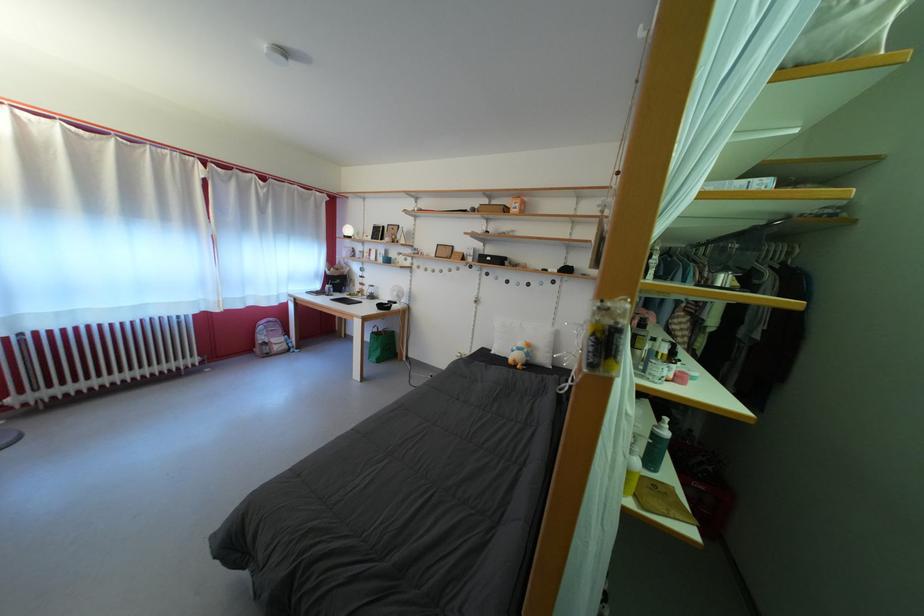
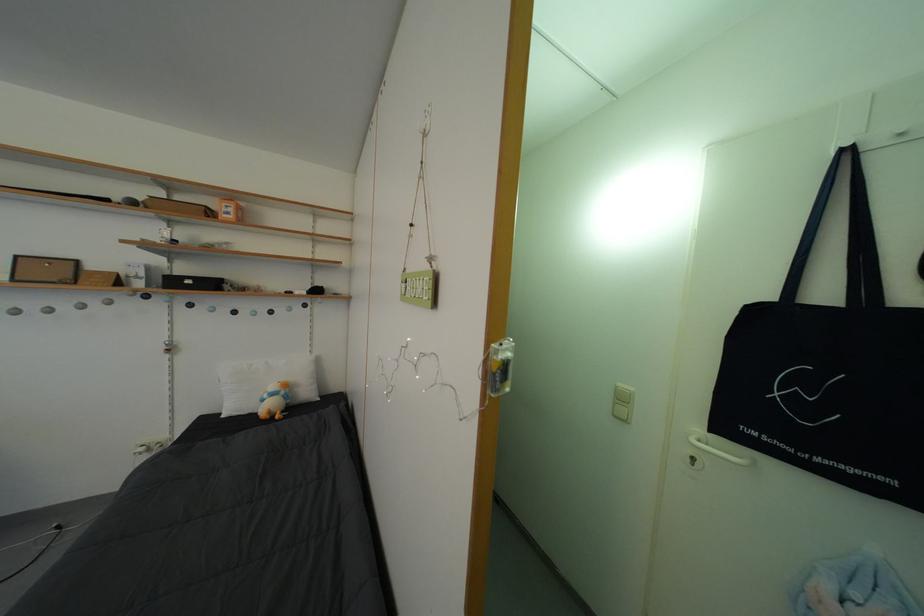
Question: The camera is either moving clockwise (left) or counter-clockwise (right) around the object. The first image is from the beginning of the video and the second image is from the end. Is the camera moving left or right when shooting the video?

Choices:
 (A) Left
 (B) Right

Answer: (A)